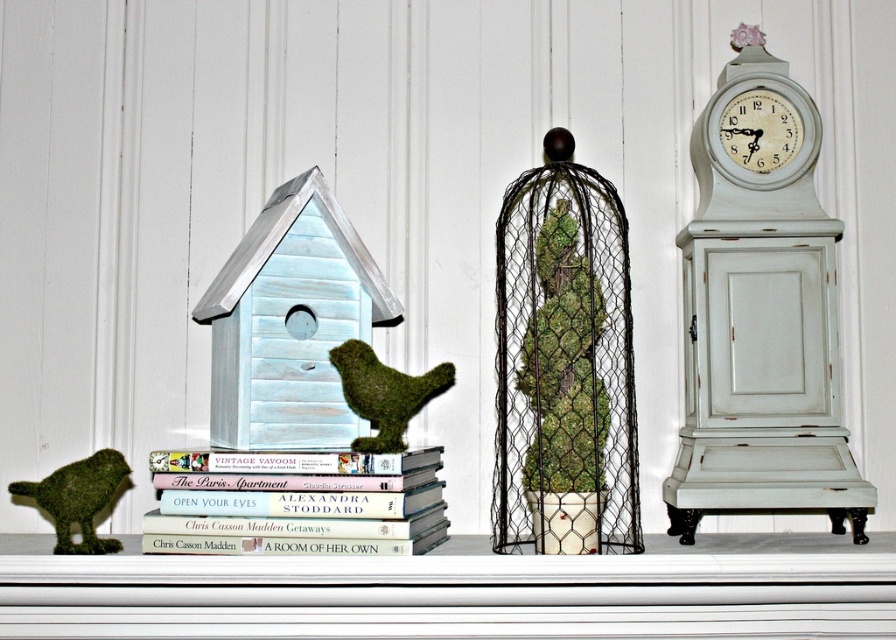
At what (x,y) coordinates should I click in order to perform the action: click on white distressed wood clock at right. Please return your answer as a coordinate pair (x, y). Image resolution: width=896 pixels, height=640 pixels. Looking at the image, I should click on (760, 310).

Between white distressed wood clock at right and green moss bird at center, which one has less height?

With less height is green moss bird at center.

Is point (746, 216) less distant than point (373, 365)?

No, (746, 216) is further to viewer.

Identify the location of white distressed wood clock at right. (760, 310).

Who is more forward, [817,240] or [593,522]?

Point [593,522] is in front.

Who is positioned more to the right, white distressed wood clock at right or wire mesh birdcage at center?

white distressed wood clock at right

What do you see at coordinates (760, 310) in the screenshot?
I see `white distressed wood clock at right` at bounding box center [760, 310].

This screenshot has width=896, height=640. I want to click on white distressed wood clock at right, so click(x=760, y=310).

Between wire mesh birdcage at center and hardcover books at center, which one is positioned lower?

hardcover books at center

Is wire mesh birdcage at center closer to the viewer compared to hardcover books at center?

No, it is not.

Is point (608, 518) positioned behind point (213, 536)?

That is True.

Locate an element on the screen. The height and width of the screenshot is (640, 896). wire mesh birdcage at center is located at coordinates (563, 362).